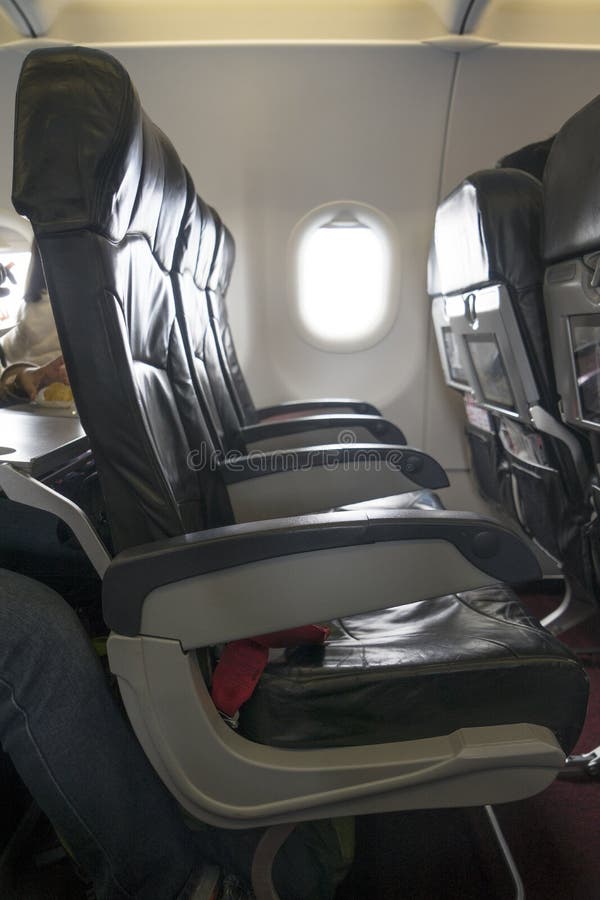
Identify the location of chair arm rest. (375, 556), (350, 488), (364, 423), (357, 409).